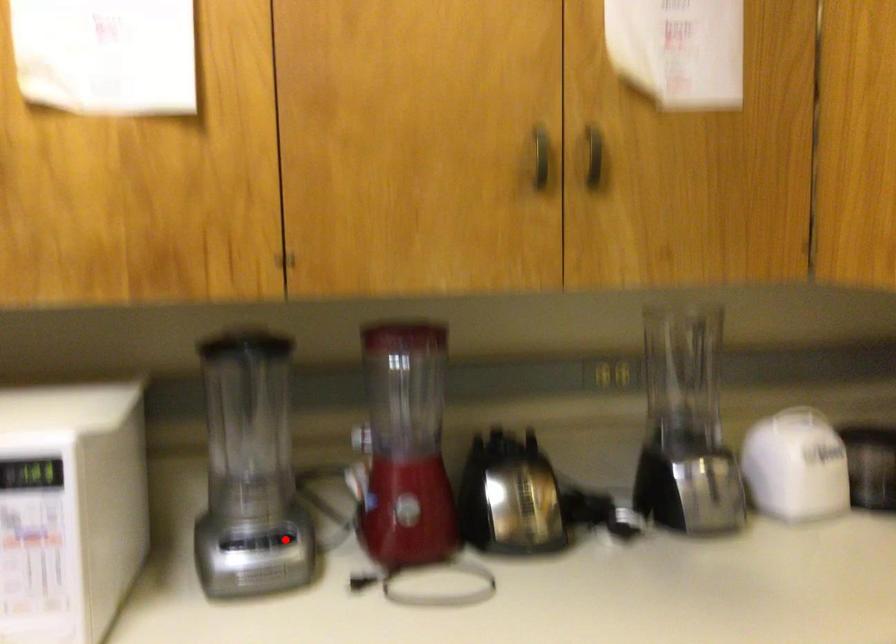
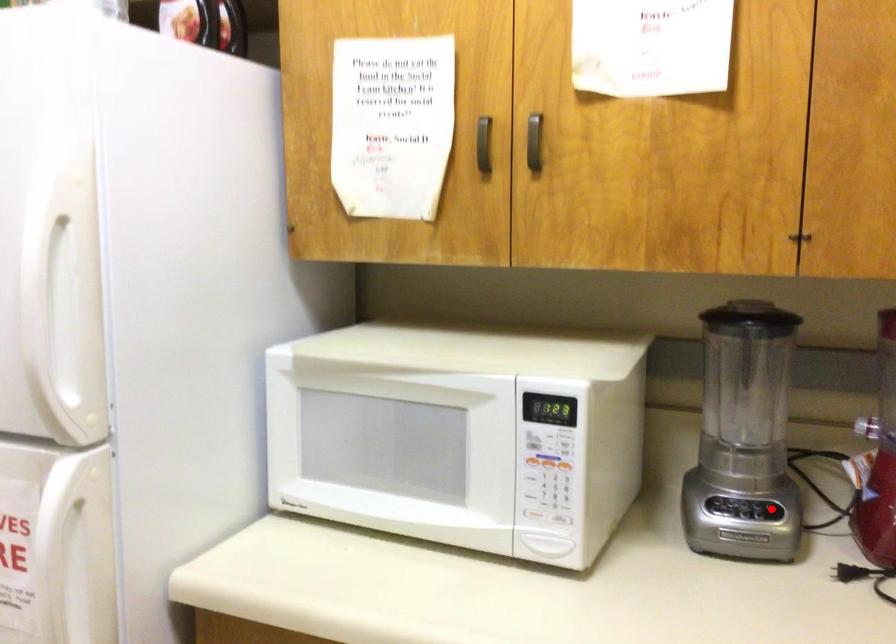
I am providing you with two images of the same scene from different viewpoints. A red point is marked on the first image and another point is marked on the second image. Is the red point in image1 aligned with the point shown in image2?

Yes